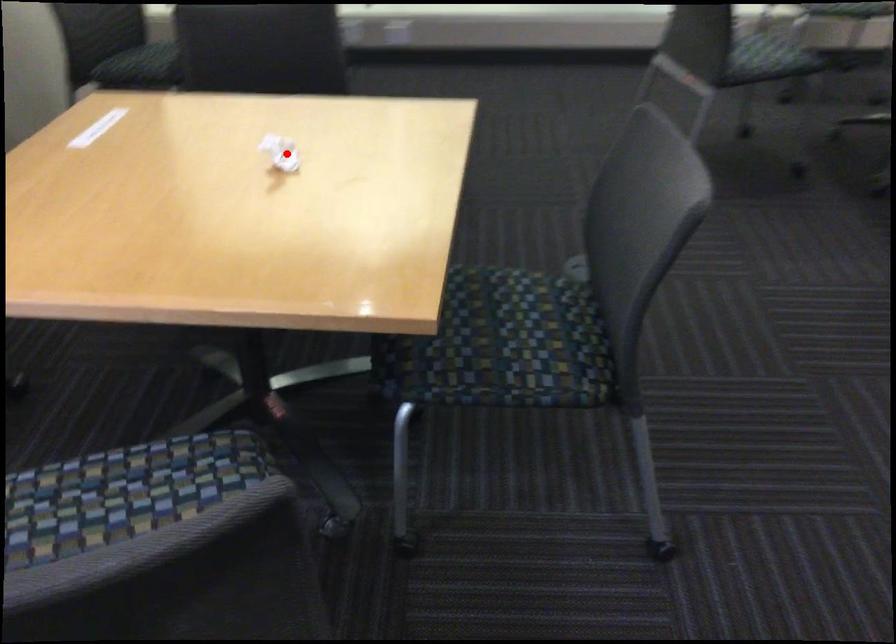
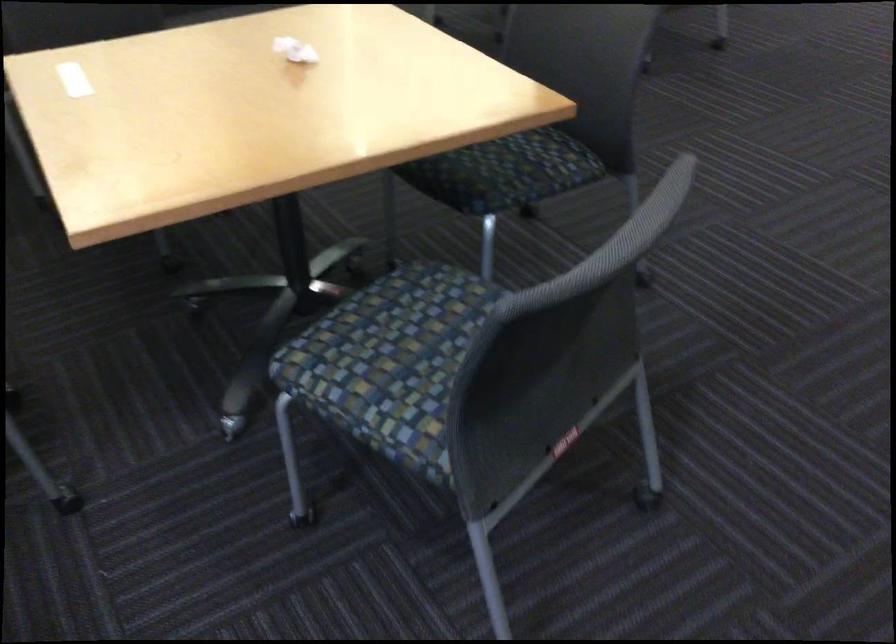
Locate, in the second image, the point that corresponds to the highlighted location in the first image.

(295, 50)